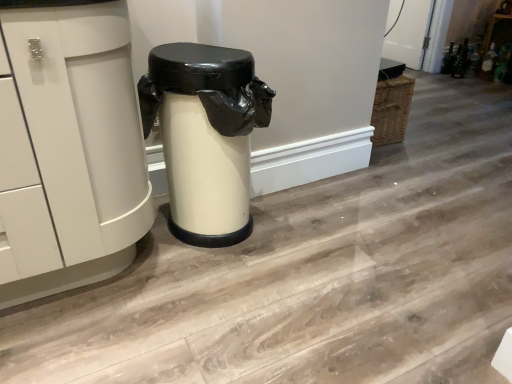
Locate an element on the screen. vacant space to the right of matte white cabinet at left is located at coordinates 240,288.